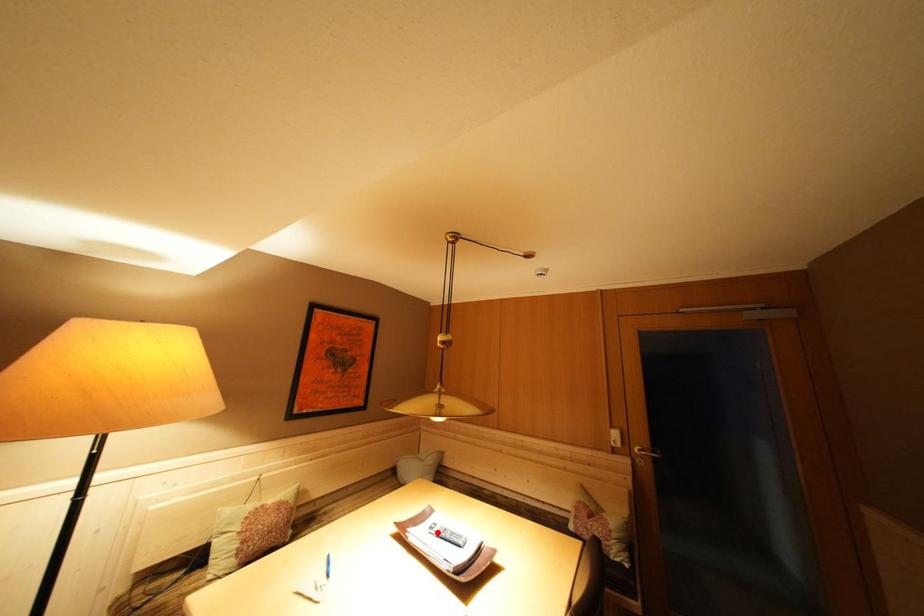
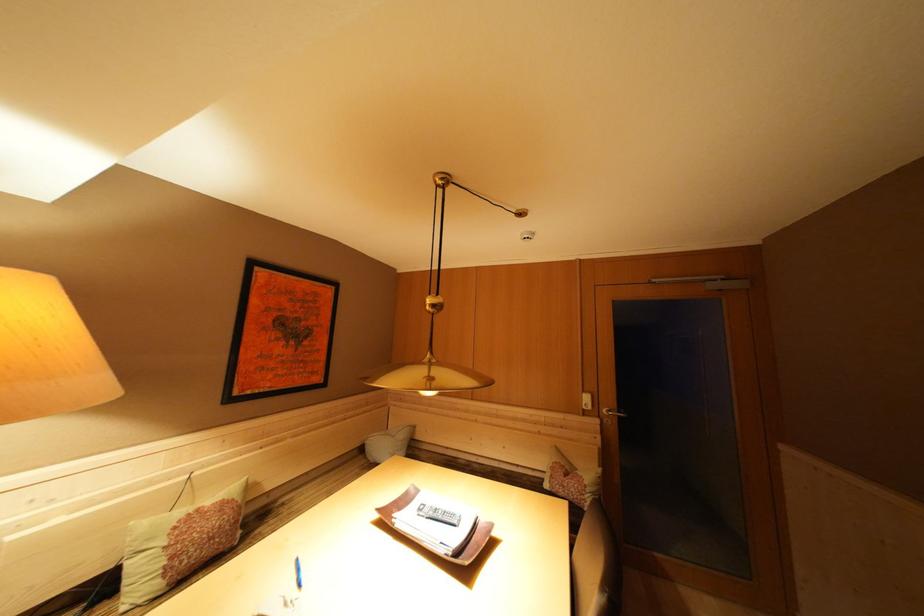
The point at the highlighted location is marked in the first image. Where is the corresponding point in the second image?

(427, 515)